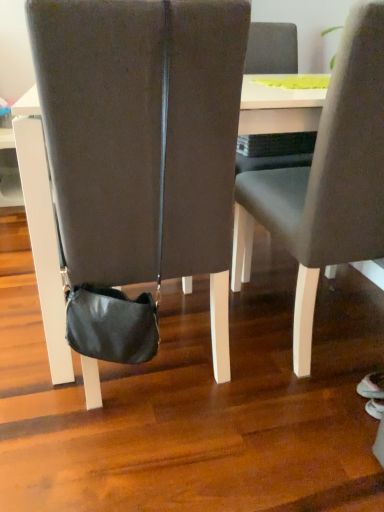
What do you see at coordinates (326, 181) in the screenshot?
I see `matte gray chair at center, the second chair positioned from the left` at bounding box center [326, 181].

You are a GUI agent. You are given a task and a screenshot of the screen. Output one action in this format:
    pyautogui.click(x=<x>, y=<y>)
    Task: Click on the white glossy table at center
    This screenshot has height=512, width=384.
    Given the screenshot: What is the action you would take?
    pyautogui.click(x=278, y=108)

What are the coordinates of `matte gray chair at center, the first chair from the right` in the screenshot? It's located at (326, 181).

At what (x,y) coordinates should I click in order to perform the action: click on chair lying behind the black leather bag at center, arranged as the first chair when viewed from the left. Please return your answer as a coordinate pair (x, y). Looking at the image, I should click on (326, 181).

Which of these two, black leather bag at center, the second chair in the right-to-left sequence, or matte gray chair at center, the first chair from the right, is wider?

Wider between the two is black leather bag at center, the second chair in the right-to-left sequence.

Does black leather bag at center, the second chair in the right-to-left sequence, lie behind matte gray chair at center, the second chair positioned from the left?

No, it is not.

Consider the image. Considering the relative sizes of black leather bag at center, arranged as the first chair when viewed from the left, and white glossy table at center in the image provided, is black leather bag at center, arranged as the first chair when viewed from the left, thinner than white glossy table at center?

Yes.

Is white glossy table at center located within black leather bag at center, arranged as the first chair when viewed from the left?

Definitely not — white glossy table at center is not inside black leather bag at center, arranged as the first chair when viewed from the left.

Does point (204, 206) appear closer or farther from the camera than point (312, 121)?

Point (204, 206) is closer to the camera than point (312, 121).

From a real-world perspective, is matte gray chair at center, the first chair from the right, physically above white glossy table at center?

Yes.

Which object is thinner, matte gray chair at center, the second chair positioned from the left, or white glossy table at center?

matte gray chair at center, the second chair positioned from the left, is thinner.

From the image's perspective, is matte gray chair at center, the second chair positioned from the left, above or below white glossy table at center?

From the image's perspective, matte gray chair at center, the second chair positioned from the left, appears below white glossy table at center.

Which is more to the left, matte gray chair at center, the second chair positioned from the left, or white glossy table at center?

white glossy table at center.

From a real-world perspective, is white glossy table at center physically located above or below matte gray chair at center, the second chair positioned from the left?

In terms of real-world spatial position, white glossy table at center is below matte gray chair at center, the second chair positioned from the left.

From the white glossy table at center, count 1st chairs forward and point to it. Please provide its 2D coordinates.

[(326, 181)]

Is white glossy table at center next to matte gray chair at center, the first chair from the right?

No, white glossy table at center is not in contact with matte gray chair at center, the first chair from the right.

Considering the relative sizes of white glossy table at center and matte gray chair at center, the first chair from the right, in the image provided, is white glossy table at center wider than matte gray chair at center, the first chair from the right,?

Yes.

Considering the sizes of matte gray chair at center, the first chair from the right, and black leather bag at center, arranged as the first chair when viewed from the left, in the image, is matte gray chair at center, the first chair from the right, taller or shorter than black leather bag at center, arranged as the first chair when viewed from the left,?

matte gray chair at center, the first chair from the right, is taller than black leather bag at center, arranged as the first chair when viewed from the left.

Between matte gray chair at center, the second chair positioned from the left, and black leather bag at center, arranged as the first chair when viewed from the left, which one has larger size?

black leather bag at center, arranged as the first chair when viewed from the left.

Are matte gray chair at center, the second chair positioned from the left, and black leather bag at center, arranged as the first chair when viewed from the left, far apart?

matte gray chair at center, the second chair positioned from the left, is actually quite close to black leather bag at center, arranged as the first chair when viewed from the left.

How distant is matte gray chair at center, the second chair positioned from the left, from black leather bag at center, arranged as the first chair when viewed from the left?

matte gray chair at center, the second chair positioned from the left, is 14.18 inches from black leather bag at center, arranged as the first chair when viewed from the left.

Between white glossy table at center and black leather bag at center, arranged as the first chair when viewed from the left, which one has smaller size?

Smaller between the two is black leather bag at center, arranged as the first chair when viewed from the left.

Is white glossy table at center taller than black leather bag at center, arranged as the first chair when viewed from the left?

No, white glossy table at center is not taller than black leather bag at center, arranged as the first chair when viewed from the left.

Between point (281, 89) and point (100, 255), which one is positioned in front?

The point (100, 255) is closer to the camera.

Based on the photo, between white glossy table at center and black leather bag at center, the second chair in the right-to-left sequence, which one appears on the left side from the viewer's perspective?

Positioned to the left is black leather bag at center, the second chair in the right-to-left sequence.

Image resolution: width=384 pixels, height=512 pixels. I want to click on chair below the matte gray chair at center, the first chair from the right (from a real-world perspective), so click(x=143, y=139).

Locate an element on the screen. This screenshot has width=384, height=512. the 1st chair directly above the white glossy table at center (from a real-world perspective) is located at coordinates (143, 139).

From the image, which object appears to be farther from black leather bag at center, the second chair in the right-to-left sequence, matte gray chair at center, the second chair positioned from the left, or white glossy table at center?

matte gray chair at center, the second chair positioned from the left, lies further to black leather bag at center, the second chair in the right-to-left sequence, than the other object.

When comparing their distances from matte gray chair at center, the first chair from the right, does black leather bag at center, the second chair in the right-to-left sequence, or white glossy table at center seem further?

black leather bag at center, the second chair in the right-to-left sequence, is positioned further to the anchor matte gray chair at center, the first chair from the right.

Estimate the real-world distances between objects in this image. Which object is further from matte gray chair at center, the first chair from the right, white glossy table at center or black leather bag at center, the second chair in the right-to-left sequence?

black leather bag at center, the second chair in the right-to-left sequence, lies further to matte gray chair at center, the first chair from the right, than the other object.

Considering their positions, is white glossy table at center positioned further to black leather bag at center, the second chair in the right-to-left sequence, than matte gray chair at center, the second chair positioned from the left?

Based on the image, matte gray chair at center, the second chair positioned from the left, appears to be further to black leather bag at center, the second chair in the right-to-left sequence.

Consider the image. Based on their spatial positions, is matte gray chair at center, the second chair positioned from the left, or black leather bag at center, arranged as the first chair when viewed from the left, further from white glossy table at center?

Based on the image, black leather bag at center, arranged as the first chair when viewed from the left, appears to be further to white glossy table at center.

Looking at the image, which one is located further to white glossy table at center, black leather bag at center, arranged as the first chair when viewed from the left, or matte gray chair at center, the second chair positioned from the left?

black leather bag at center, arranged as the first chair when viewed from the left, is further to white glossy table at center.

Where is `table between black leather bag at center, the second chair in the right-to-left sequence, and matte gray chair at center, the first chair from the right, in the horizontal direction`? Image resolution: width=384 pixels, height=512 pixels. table between black leather bag at center, the second chair in the right-to-left sequence, and matte gray chair at center, the first chair from the right, in the horizontal direction is located at coordinates (278, 108).